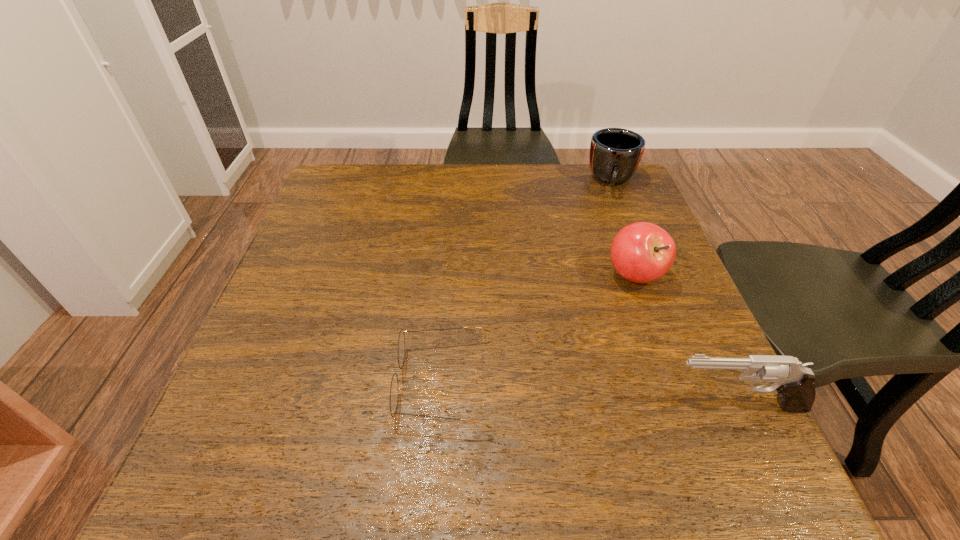
At what (x,y) coordinates should I click in order to perform the action: click on free space that satisfies the following two spatial constraints: 1. on the front side of the gun; 2. at the muzzle of the second farthest object. Please return your answer as a coordinate pair (x, y). This screenshot has width=960, height=540. Looking at the image, I should click on (683, 405).

Image resolution: width=960 pixels, height=540 pixels. In order to click on free space that satisfies the following two spatial constraints: 1. on the front side of the mug; 2. at the muzzle of the gun in this screenshot , I will do `click(702, 405)`.